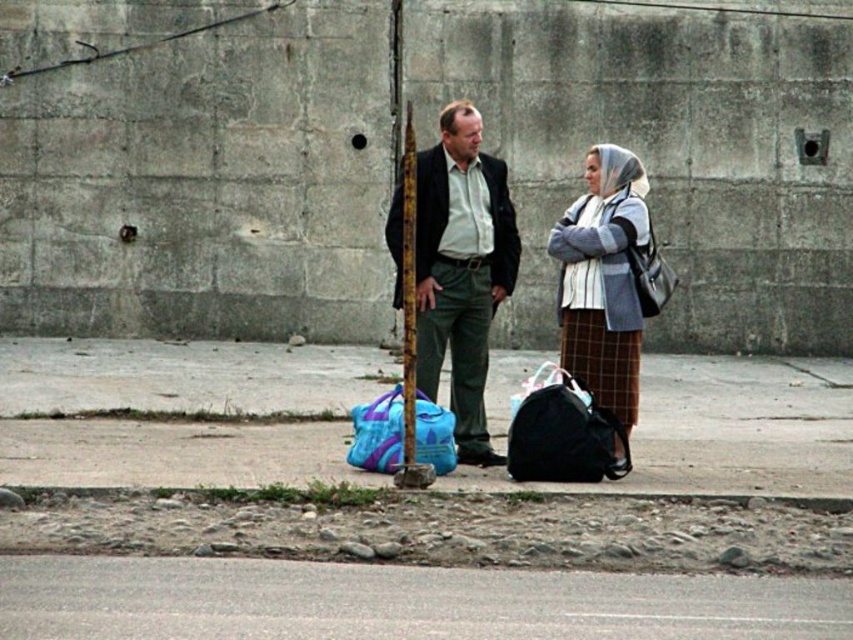
How distant is smooth concrete curb at lower center from brushed metal pole at center?

smooth concrete curb at lower center is 7.03 feet from brushed metal pole at center.

Does smooth concrete curb at lower center have a lesser width compared to brushed metal pole at center?

No, smooth concrete curb at lower center is not thinner than brushed metal pole at center.

Is point (315, 493) closer to camera compared to point (412, 342)?

That is True.

Locate an element on the screen. The image size is (853, 640). smooth concrete curb at lower center is located at coordinates (410, 496).

Does point (399, 404) lie behind point (653, 266)?

No, it is not.

Does matte blue duffel bag at center appear on the left side of matte black bag at right?

Yes, matte blue duffel bag at center is to the left of matte black bag at right.

Who is more distant from viewer, [450,442] or [660,284]?

The point [660,284] is more distant.

Locate an element on the screen. matte blue duffel bag at center is located at coordinates tap(376, 433).

Which is below, plaid skirt at center or matte blue duffel bag at center?

matte blue duffel bag at center is lower down.

Is point (614, 461) behind point (402, 438)?

Yes, it is.

Does point (648, 234) lie in front of point (381, 403)?

No, it is not.

At what (x,y) coordinates should I click in order to perform the action: click on plaid skirt at center. Please return your answer as a coordinate pair (x, y). The width and height of the screenshot is (853, 640). Looking at the image, I should click on (602, 284).